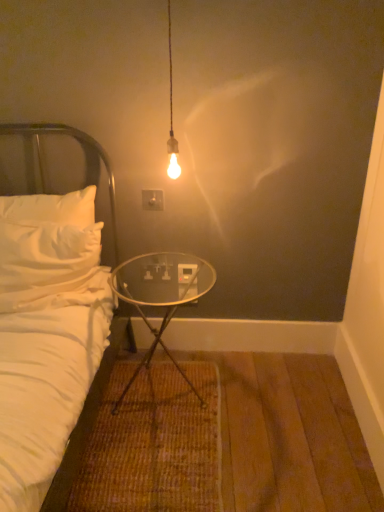
You are a GUI agent. You are given a task and a screenshot of the screen. Output one action in this format:
    pyautogui.click(x=<x>, y=<y>)
    Task: Click on the white fabric headboard at left
    The width and height of the screenshot is (384, 512).
    Given the screenshot: What is the action you would take?
    pyautogui.click(x=77, y=141)

You are a GUI agent. You are given a task and a screenshot of the screen. Output one action in this format:
    pyautogui.click(x=<x>, y=<y>)
    Task: Click on the white plastic electric outlet at center
    
    Given the screenshot: What is the action you would take?
    pyautogui.click(x=152, y=200)

You are a GUI agent. You are given a task and a screenshot of the screen. Output one action in this format:
    pyautogui.click(x=<x>, y=<y>)
    Task: Click on the white fabric headboard at left
    This screenshot has width=384, height=512.
    Given the screenshot: What is the action you would take?
    pyautogui.click(x=77, y=141)

Considering their positions, is white plastic electric outlet at center located in front of or behind transparent glass table at center?

Visually, white plastic electric outlet at center is located behind transparent glass table at center.

How different are the orientations of white plastic electric outlet at center and transparent glass table at center in degrees?

0.167 degrees separate the facing orientations of white plastic electric outlet at center and transparent glass table at center.

Considering the sizes of objects white plastic electric outlet at center and transparent glass table at center in the image provided, who is bigger, white plastic electric outlet at center or transparent glass table at center?

With larger size is transparent glass table at center.

Between white plastic electric outlet at center and transparent glass table at center, which one has smaller width?

white plastic electric outlet at center.

Is white fabric headboard at left positioned far away from white plastic electric outlet at center?

They are positioned close to each other.

Where is `headboard in front of the white plastic electric outlet at center`? Image resolution: width=384 pixels, height=512 pixels. headboard in front of the white plastic electric outlet at center is located at coordinates (77, 141).

Considering the points (32, 170) and (157, 203), which point is in front, point (32, 170) or point (157, 203)?

The point (32, 170) is more forward.

From a real-world perspective, is white fabric headboard at left under white plastic electric outlet at center?

Yes, from a real-world perspective, white fabric headboard at left is under white plastic electric outlet at center.

Is transparent glass table at center outside of white plastic electric outlet at center?

Yes, transparent glass table at center is located beyond the bounds of white plastic electric outlet at center.

Consider the image. Considering the sizes of transparent glass table at center and white plastic electric outlet at center in the image, is transparent glass table at center wider or thinner than white plastic electric outlet at center?

Clearly, transparent glass table at center has more width compared to white plastic electric outlet at center.

I want to click on electric outlet above the transparent glass table at center (from the image's perspective), so click(152, 200).

Does transparent glass table at center have a smaller size compared to white plastic electric outlet at center?

No.

In terms of width, does transparent glass table at center look wider or thinner when compared to white fabric headboard at left?

transparent glass table at center is wider than white fabric headboard at left.

In the image, is transparent glass table at center on the left side or the right side of white fabric headboard at left?

transparent glass table at center is to the right of white fabric headboard at left.

From their relative heights in the image, would you say transparent glass table at center is taller or shorter than white fabric headboard at left?

Considering their sizes, transparent glass table at center has less height than white fabric headboard at left.

Considering the relative sizes of white plastic electric outlet at center and white fabric headboard at left in the image provided, is white plastic electric outlet at center wider than white fabric headboard at left?

No, white plastic electric outlet at center is not wider than white fabric headboard at left.

Is white plastic electric outlet at center bigger or smaller than white fabric headboard at left?

Clearly, white plastic electric outlet at center is smaller in size than white fabric headboard at left.

Measure the distance from white plastic electric outlet at center to white fabric headboard at left.

white plastic electric outlet at center and white fabric headboard at left are 31.76 centimeters apart from each other.

Considering the sizes of objects white plastic electric outlet at center and white fabric headboard at left in the image provided, who is taller, white plastic electric outlet at center or white fabric headboard at left?

With more height is white fabric headboard at left.

Between white fabric headboard at left and transparent glass table at center, which one has less height?

transparent glass table at center is shorter.

Considering the relative sizes of white fabric headboard at left and transparent glass table at center in the image provided, is white fabric headboard at left smaller than transparent glass table at center?

Yes, white fabric headboard at left is smaller than transparent glass table at center.

Which is in front, point (111, 207) or point (133, 288)?

Positioned in front is point (111, 207).

Is white fabric headboard at left at the right side of transparent glass table at center?

Incorrect, white fabric headboard at left is not on the right side of transparent glass table at center.

Locate an element on the screen. The image size is (384, 512). table in front of the white plastic electric outlet at center is located at coordinates (161, 295).

Identify the location of headboard below the white plastic electric outlet at center (from the image's perspective). Image resolution: width=384 pixels, height=512 pixels. (77, 141).

Based on the photo, when comparing their distances from transparent glass table at center, does white plastic electric outlet at center or white fabric headboard at left seem further?

white fabric headboard at left.

From the image, which object appears to be nearer to white plastic electric outlet at center, transparent glass table at center or white fabric headboard at left?

white fabric headboard at left lies closer to white plastic electric outlet at center than the other object.

Looking at the image, which one is located further to transparent glass table at center, white fabric headboard at left or white plastic electric outlet at center?

white fabric headboard at left is further to transparent glass table at center.

Based on their spatial positions, is white fabric headboard at left or transparent glass table at center further from white plastic electric outlet at center?

transparent glass table at center.

Looking at the image, which one is located further to white fabric headboard at left, white plastic electric outlet at center or transparent glass table at center?

Based on the image, transparent glass table at center appears to be further to white fabric headboard at left.

Based on their spatial positions, is transparent glass table at center or white plastic electric outlet at center closer to white fabric headboard at left?

Among the two, white plastic electric outlet at center is located nearer to white fabric headboard at left.

Locate an element on the screen. The width and height of the screenshot is (384, 512). headboard between white plastic electric outlet at center and transparent glass table at center in the up-down direction is located at coordinates (77, 141).